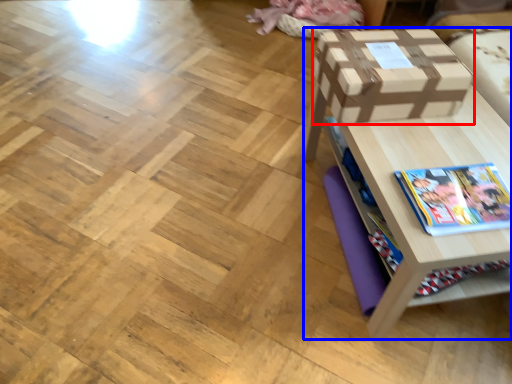
Question: Which object appears farthest to the camera in this image, box (highlighted by a red box) or table (highlighted by a blue box)?

Choices:
 (A) box
 (B) table

Answer: (A)